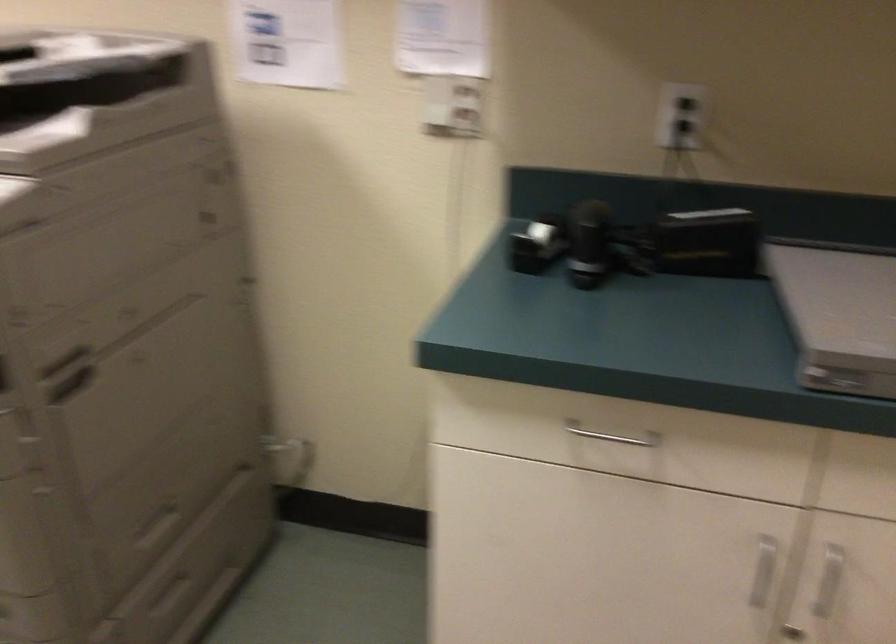
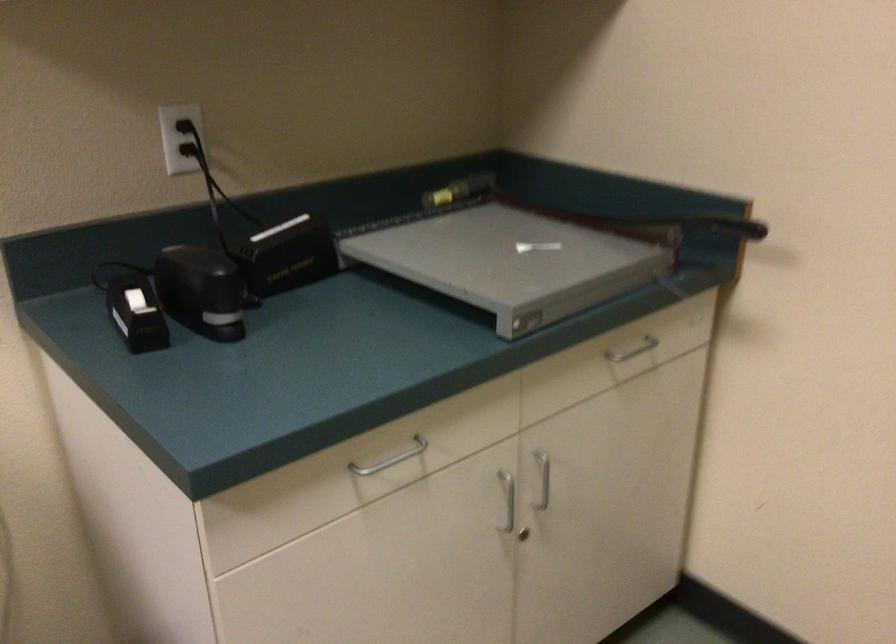
Find the pixel in the second image that matches (686,124) in the first image.

(192, 149)